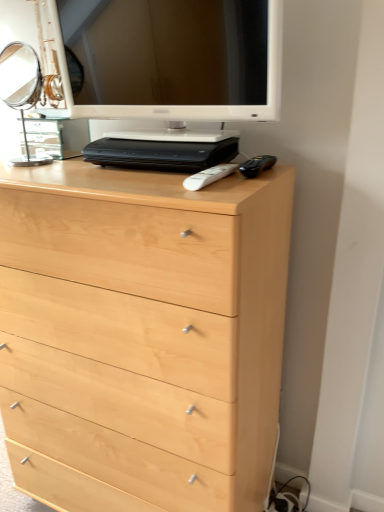
Identify the location of free space to the left of white plastic remote at center. Image resolution: width=384 pixels, height=512 pixels. 159,172.